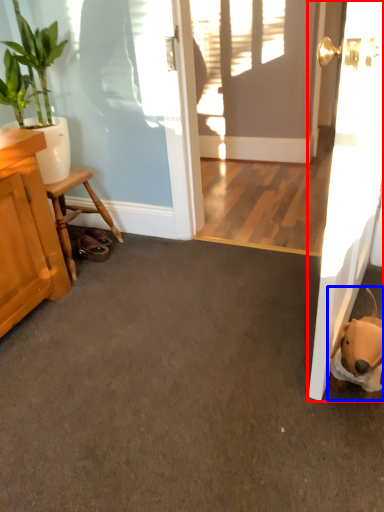
Question: Which object is further to the camera taking this photo, door (highlighted by a red box) or animal (highlighted by a blue box)?

Choices:
 (A) door
 (B) animal

Answer: (B)